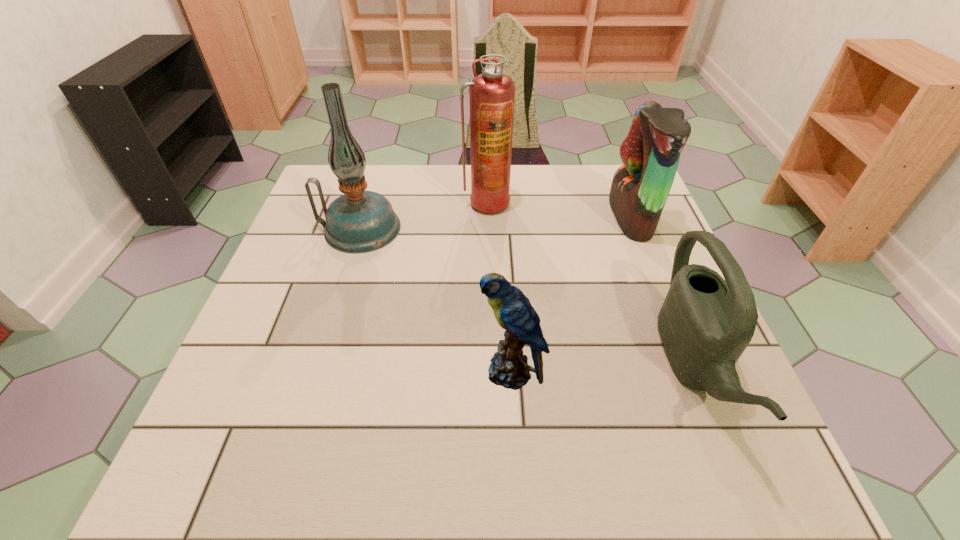
Identify the location of parrot present at the far edge. (650, 153).

The image size is (960, 540). I want to click on object that is positioned at the near edge, so click(705, 323).

This screenshot has width=960, height=540. I want to click on object present at the left edge, so click(x=359, y=221).

Where is `parrot that is at the right edge`? Image resolution: width=960 pixels, height=540 pixels. parrot that is at the right edge is located at coordinates (650, 153).

Locate an element on the screen. The width and height of the screenshot is (960, 540). watering can that is at the right edge is located at coordinates pyautogui.click(x=705, y=323).

The image size is (960, 540). What are the coordinates of `object that is at the far left corner` in the screenshot? It's located at 359,221.

I want to click on object present at the far right corner, so click(x=650, y=153).

The height and width of the screenshot is (540, 960). I want to click on object that is at the near right corner, so click(x=705, y=323).

Identify the location of vacant space at the far edge of the desktop. The width and height of the screenshot is (960, 540). click(x=544, y=193).

In the image, there is a desktop. Identify the location of blank space at the near edge. (359, 476).